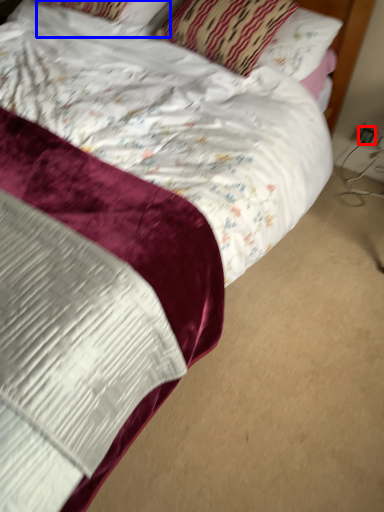
Question: Which object appears closest to the camera in this image, electric outlet (highlighted by a red box) or pillow (highlighted by a blue box)?

Choices:
 (A) electric outlet
 (B) pillow

Answer: (B)